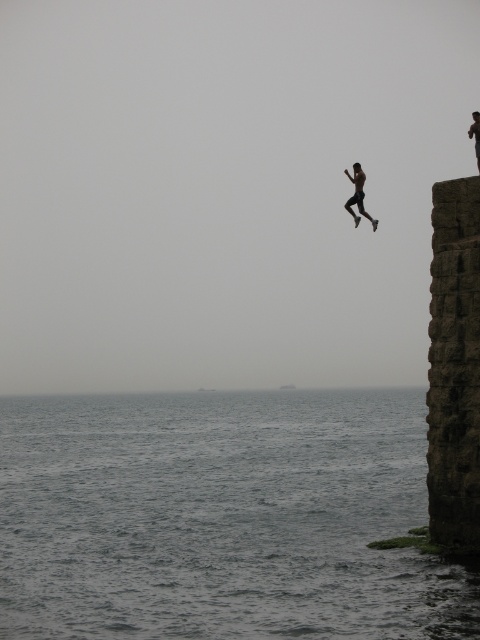
Is dark stone pillar at right further to the viewer compared to black matte person at upper right?

No, dark stone pillar at right is closer to the viewer.

Between dark stone pillar at right and black matte person at upper right, which one is positioned lower?

dark stone pillar at right is lower down.

Does point (476, 461) come closer to viewer compared to point (363, 211)?

Yes, it is in front of point (363, 211).

This screenshot has height=640, width=480. I want to click on dark stone pillar at right, so click(454, 365).

Can you confirm if gray water at lower left is thinner than black matte person at upper right?

In fact, gray water at lower left might be wider than black matte person at upper right.

Which is in front, point (389, 397) or point (358, 163)?

Point (358, 163)

Image resolution: width=480 pixels, height=640 pixels. I want to click on gray water at lower left, so click(x=220, y=516).

Is point (4, 433) more distant than point (432, 372)?

Yes, it is.

Is gray water at lower left closer to camera compared to dark stone pillar at right?

That is True.

Locate an element on the screen. gray water at lower left is located at coordinates (220, 516).